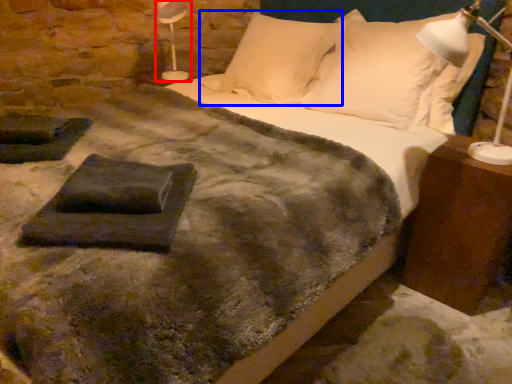
Question: Among these objects, which one is farthest to the camera, table lamp (highlighted by a red box) or pillow (highlighted by a blue box)?

Choices:
 (A) table lamp
 (B) pillow

Answer: (A)